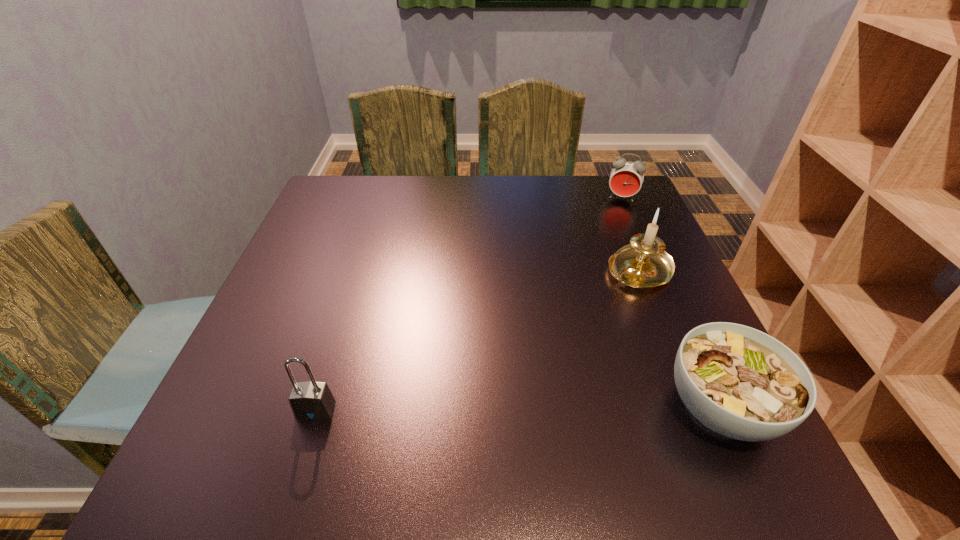
At what (x,y) coordinates should I click in order to perform the action: click on vacant area situated 0.250m on the face of the farthest object. Please return your answer as a coordinate pair (x, y). The image size is (960, 540). Looking at the image, I should click on (607, 259).

Find the location of a particular element. The height and width of the screenshot is (540, 960). free space located on the face of the farthest object is located at coordinates (608, 254).

Find the location of a particular element. The image size is (960, 540). object that is at the far edge is located at coordinates (626, 178).

Where is `padlock present at the near edge`? padlock present at the near edge is located at coordinates (312, 400).

Identify the location of soup bowl at the near edge. This screenshot has height=540, width=960. (740, 382).

Where is `object that is at the left edge`? This screenshot has height=540, width=960. object that is at the left edge is located at coordinates (312, 400).

Locate an element on the screen. This screenshot has height=540, width=960. soup bowl that is at the right edge is located at coordinates (740, 382).

Identify the location of candle holder that is at the right edge. The height and width of the screenshot is (540, 960). (644, 263).

You are a GUI agent. You are given a task and a screenshot of the screen. Output one action in this format:
    pyautogui.click(x=<x>, y=<y>)
    Task: Click on the alarm clock present at the right edge
    
    Given the screenshot: What is the action you would take?
    pyautogui.click(x=626, y=178)

Where is `object at the near left corner`? object at the near left corner is located at coordinates (312, 400).